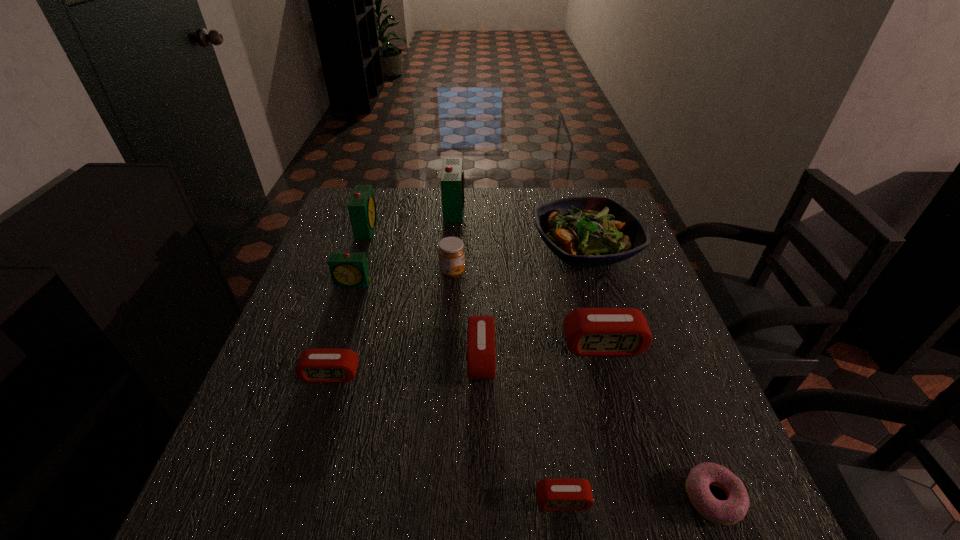
Where is `the biggest green alarm clock`? The height and width of the screenshot is (540, 960). the biggest green alarm clock is located at coordinates (452, 177).

Where is `the tallest object`? the tallest object is located at coordinates (452, 177).

Locate an element on the screen. The height and width of the screenshot is (540, 960). the second biggest green alarm clock is located at coordinates (362, 210).

Identify the location of salad plate. This screenshot has width=960, height=540. (587, 231).

You are a GUI agent. You are given a task and a screenshot of the screen. Output one action in this format:
    pyautogui.click(x=<x>, y=<y>)
    Task: Click on the orange jam
    Image resolution: width=960 pixels, height=540 pixels.
    Given the screenshot: What is the action you would take?
    pyautogui.click(x=451, y=251)

Find the location of a particular element. This screenshot has height=540, width=960. the nearest green alarm clock is located at coordinates (348, 270).

You are a GUI agent. You are given a task and a screenshot of the screen. Output one action in this format:
    pyautogui.click(x=<x>, y=<y>)
    Task: Click on the third farthest alarm clock
    
    Given the screenshot: What is the action you would take?
    (x=348, y=270)

The width and height of the screenshot is (960, 540). Identify the location of the rightmost alarm clock. (592, 332).

Locate an element on the screen. The height and width of the screenshot is (540, 960). the rightmost pink alarm clock is located at coordinates (592, 332).

Identify the location of the fifth tallest alarm clock. Image resolution: width=960 pixels, height=540 pixels. (481, 363).